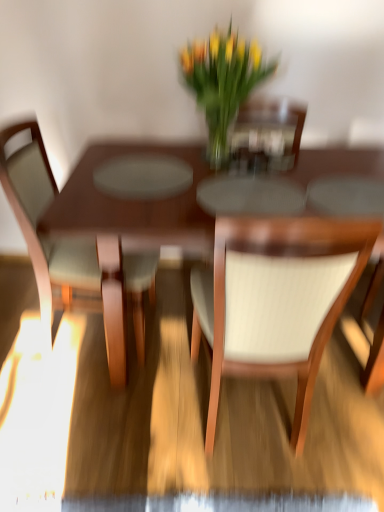
Identify the location of empty space that is in between white textured chair at center, which appears as the second chair when viewed from the left, and wooden table at center. (230, 433).